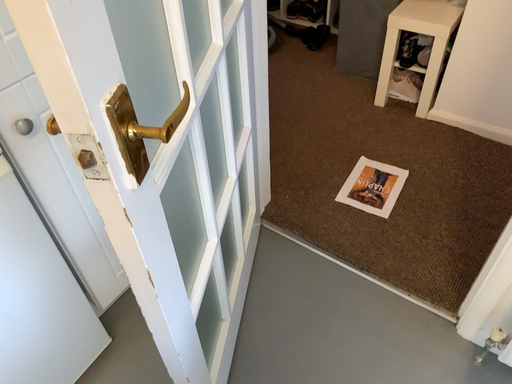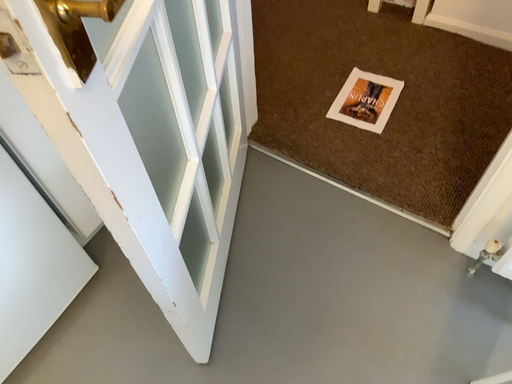
Question: How did the camera likely rotate when shooting the video?

Choices:
 (A) rotated upward
 (B) rotated downward

Answer: (B)